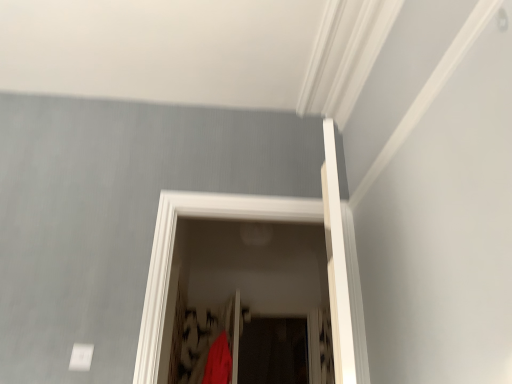
The height and width of the screenshot is (384, 512). I want to click on red fabric screen door at center, so click(173, 245).

Describe the element at coordinates (173, 245) in the screenshot. I see `red fabric screen door at center` at that location.

Image resolution: width=512 pixels, height=384 pixels. I want to click on red fabric screen door at center, so click(173, 245).